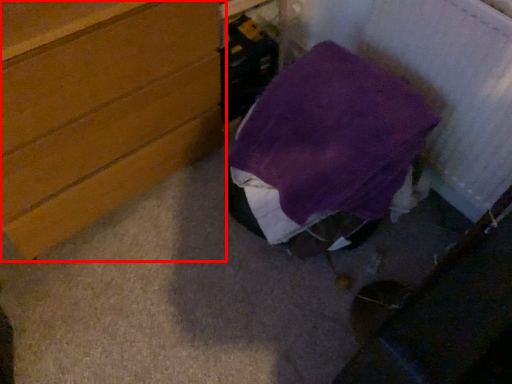
Question: In this image, where is chest of drawers (annotated by the red box) located relative to furniture?

Choices:
 (A) right
 (B) left

Answer: (B)